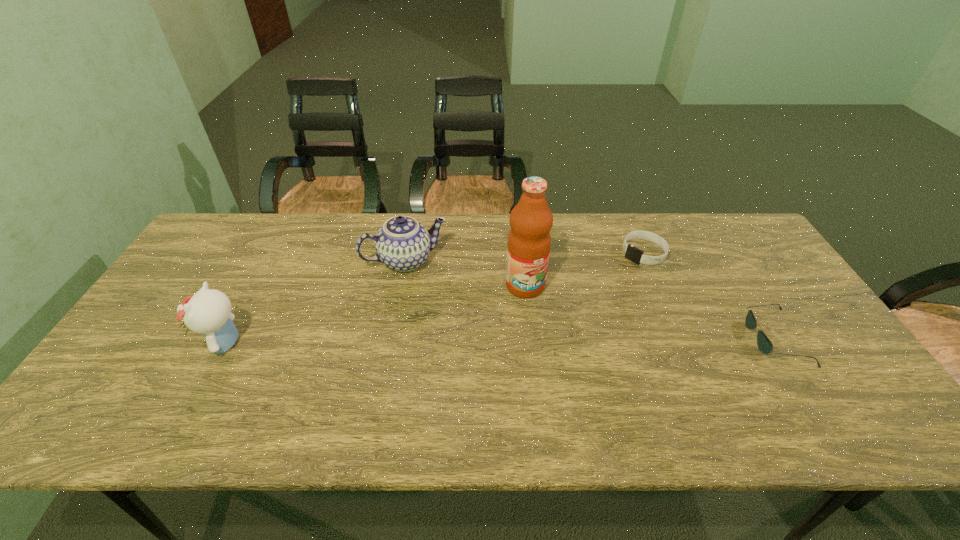
Locate an element on the screen. The height and width of the screenshot is (540, 960). free region located 0.270m on the front label of the fruit juice is located at coordinates (574, 377).

The width and height of the screenshot is (960, 540). What are the coordinates of `wristband that is at the far edge` in the screenshot? It's located at (632, 253).

Where is `chinaware at the far edge`? The height and width of the screenshot is (540, 960). chinaware at the far edge is located at coordinates (403, 244).

You are a GUI agent. You are given a task and a screenshot of the screen. Output one action in this format:
    pyautogui.click(x=<x>, y=<y>)
    Task: Click on the object positioned at the near edge
    
    Given the screenshot: What is the action you would take?
    pyautogui.click(x=765, y=346)

Identify the location of object that is at the right edge. The image size is (960, 540). (765, 346).

This screenshot has width=960, height=540. Identify the location of object that is positioned at the near right corner. (765, 346).

The image size is (960, 540). In the image, there is a desktop. What are the coordinates of `free space at the far edge` in the screenshot? It's located at (565, 235).

This screenshot has width=960, height=540. In the image, there is a desktop. What are the coordinates of `free space at the near edge` in the screenshot? It's located at (417, 400).

Locate an element on the screen. The image size is (960, 540). free space at the left edge of the desktop is located at coordinates (220, 288).

This screenshot has width=960, height=540. In order to click on vacant space at the far left corner of the desktop in this screenshot , I will do `click(211, 239)`.